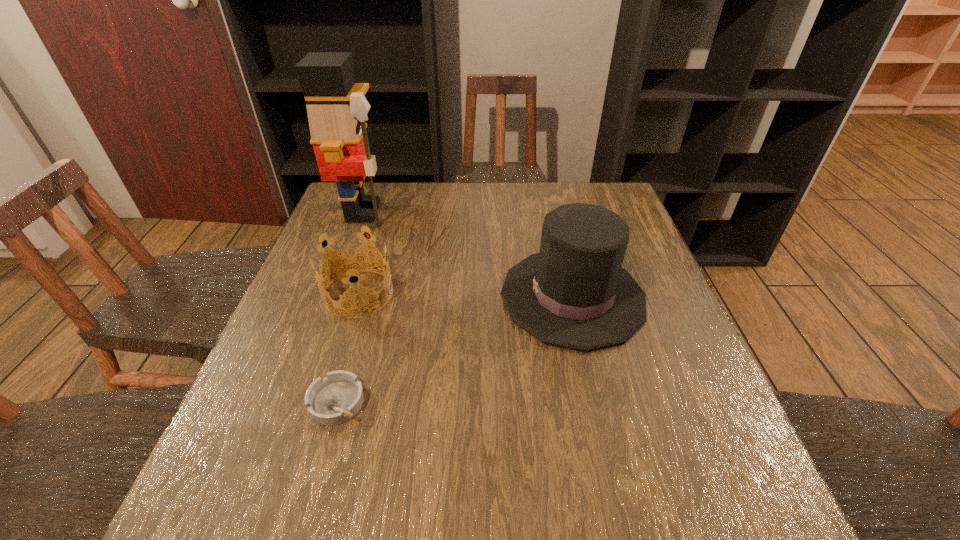
The width and height of the screenshot is (960, 540). I want to click on free space located 0.210m on the front of the rightmost object with the decoration, so click(x=414, y=296).

The height and width of the screenshot is (540, 960). I want to click on free spot located on the right of the second shortest object, so click(x=418, y=294).

Where is `free region located on the left of the ashtray`? The image size is (960, 540). free region located on the left of the ashtray is located at coordinates (x=268, y=402).

At what (x,y) coordinates should I click in order to perform the action: click on object at the far edge. Please return your answer as a coordinate pair (x, y). The image size is (960, 540). Looking at the image, I should click on (337, 109).

You are a GUI agent. You are given a task and a screenshot of the screen. Output one action in this format:
    pyautogui.click(x=<x>, y=<y>)
    Task: Click on the nutcracker that is at the left edge
    This screenshot has width=960, height=540.
    Given the screenshot: What is the action you would take?
    pyautogui.click(x=337, y=109)

Image resolution: width=960 pixels, height=540 pixels. What are the coordinates of `crown located at the left edge` in the screenshot? It's located at (350, 263).

Identify the location of ashtray that is at the left edge. The image size is (960, 540). (337, 398).

The image size is (960, 540). I want to click on object located at the right edge, so click(x=574, y=293).

This screenshot has height=540, width=960. Find the location of `object present at the far left corner`. object present at the far left corner is located at coordinates (337, 109).

The height and width of the screenshot is (540, 960). What are the coordinates of `vacant space at the far edge of the desktop` in the screenshot? It's located at (516, 198).